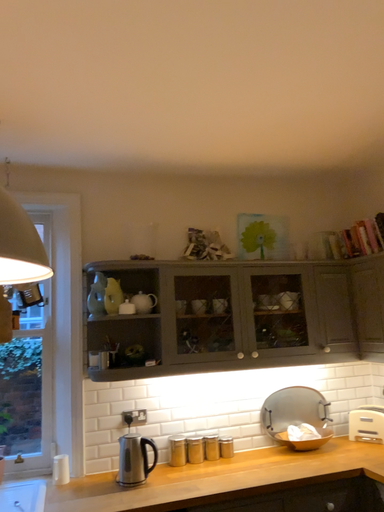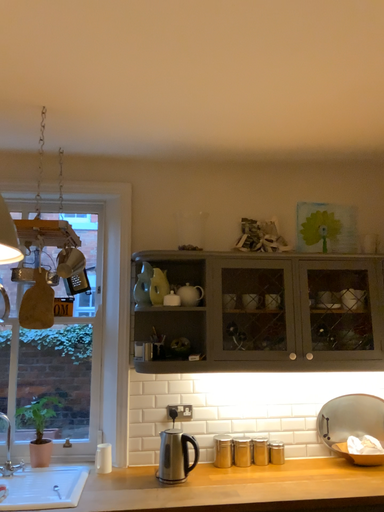
Question: Which way did the camera rotate in the video?

Choices:
 (A) rotated left
 (B) rotated right

Answer: (A)